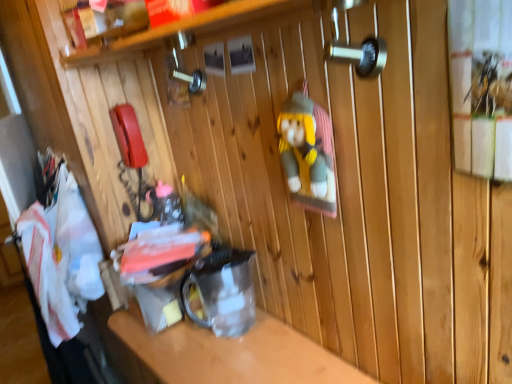
At what (x,y) coordinates should I click in order to perform the action: click on free spot above clear plastic container at center (from a real-world perspective). Please return your answer as a coordinate pair (x, y). Image resolution: width=512 pixels, height=384 pixels. Looking at the image, I should click on (219, 350).